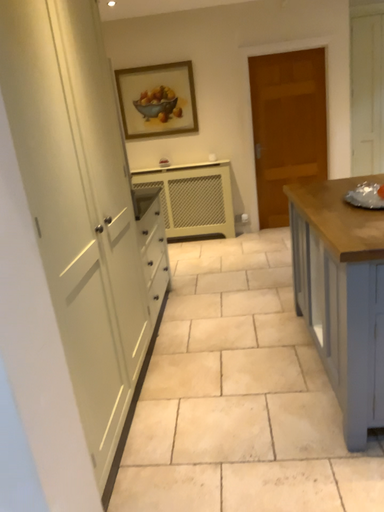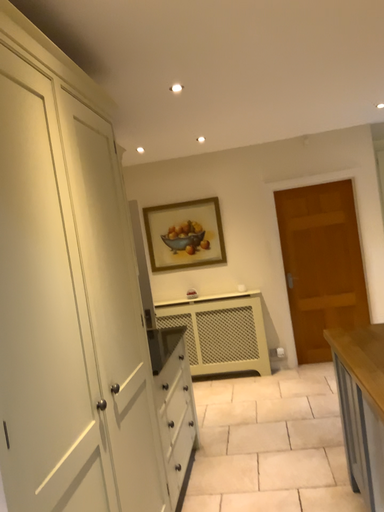
Question: Which way did the camera rotate in the video?

Choices:
 (A) rotated upward
 (B) rotated downward

Answer: (A)